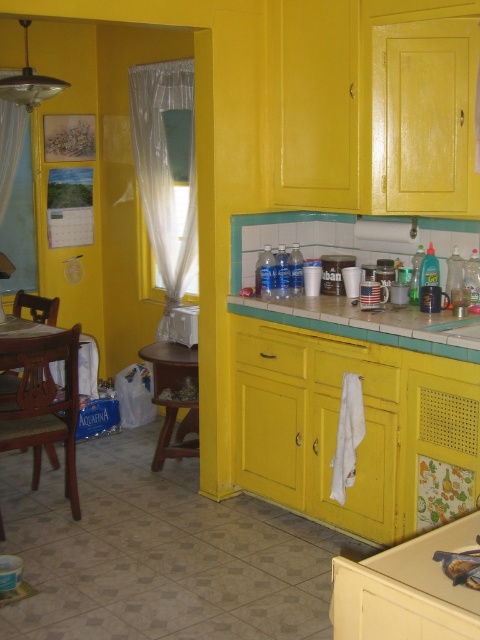
You are organizing a kitchen party and need to hang a decoration from the transparent plastic curtain at left. Since the green tile countertop at center is below it, will the decoration hang down past the countertop?

The transparent plastic curtain at left is located above the green tile countertop at center, so the decoration hung from it will hang down past the countertop.

You are standing in the kitchen and want to check the position of the transparent plastic curtain at left. What are its coordinates?

The transparent plastic curtain at left is located at coordinates point (166, 172).

You are a guest entering the kitchen and see the transparent plastic curtain at left and the green tile countertop at center. Which object is taller?

The transparent plastic curtain at left is much taller than the green tile countertop at center.